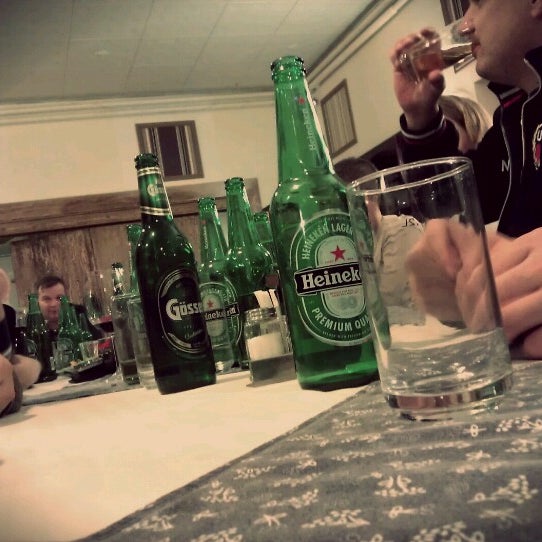
You are a GUI agent. You are given a task and a screenshot of the screen. Output one action in this format:
    pyautogui.click(x=<x>, y=<y>)
    Task: Click on the wall
    This screenshot has height=542, width=542.
    Given the screenshot: What is the action you would take?
    pyautogui.click(x=38, y=164)